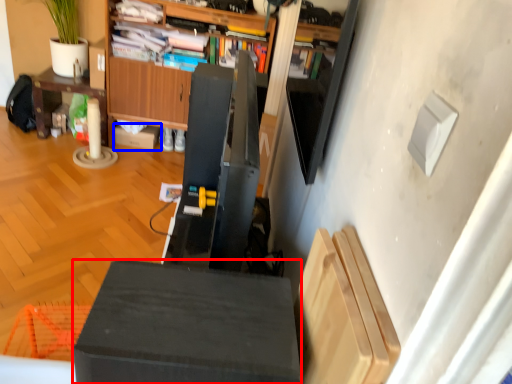
Question: Which object appears farthest to the camera in this image, furniture (highlighted by a red box) or cardboard box (highlighted by a blue box)?

Choices:
 (A) furniture
 (B) cardboard box

Answer: (B)